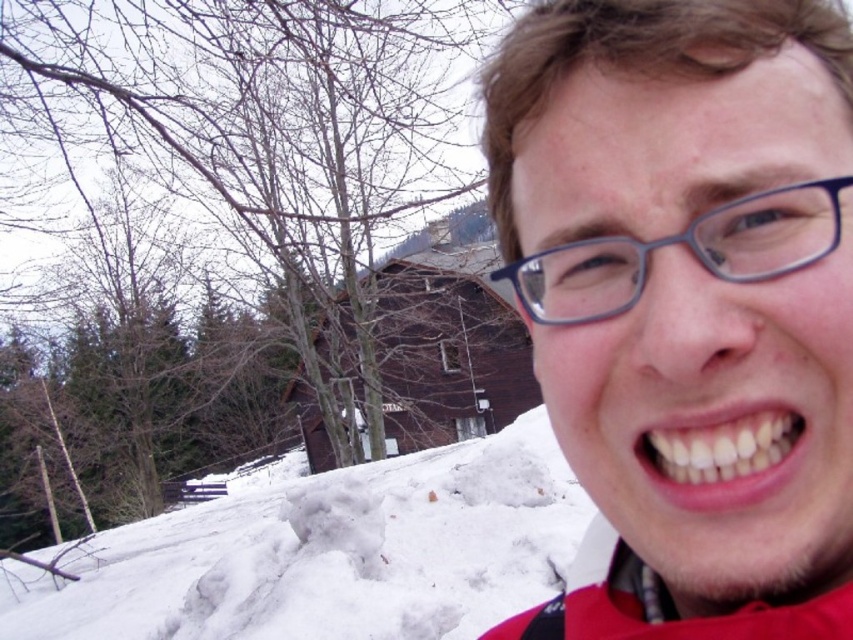
You are holding a camera and want to take a photo of the person in the scene. The camera is currently at a position that is 16.87 inches away from the point labeled as point (x=610, y=349). Can you confirm if this distance is sufficient to capture the entire person in the frame?

The camera is 16.87 inches away from point (x=610, y=349). Whether this distance is sufficient depends on the camera lens and zoom settings. However, based on typical framing, this distance might be too close to capture the entire person. Consider moving back slightly for a wider shot.

You are standing in front of the wooden building and want to take a photo of both the point at location (460, 550) and the point at (677, 445). Which point should you focus on first to ensure both are in focus?

You should focus on the point at (677, 445) first because it is closer to you than the point at (460, 550), ensuring both will be in focus when using the camera.

You are a photographer standing in front of the wooden building. You want to take a photo that includes both the white fluffy snow at lower left and the white glossy teeth at lower right. Which object will appear closer to the camera in the photo?

The white fluffy snow at lower left will appear closer to the camera in the photo because it is further to the viewer than the white glossy teeth at lower right.